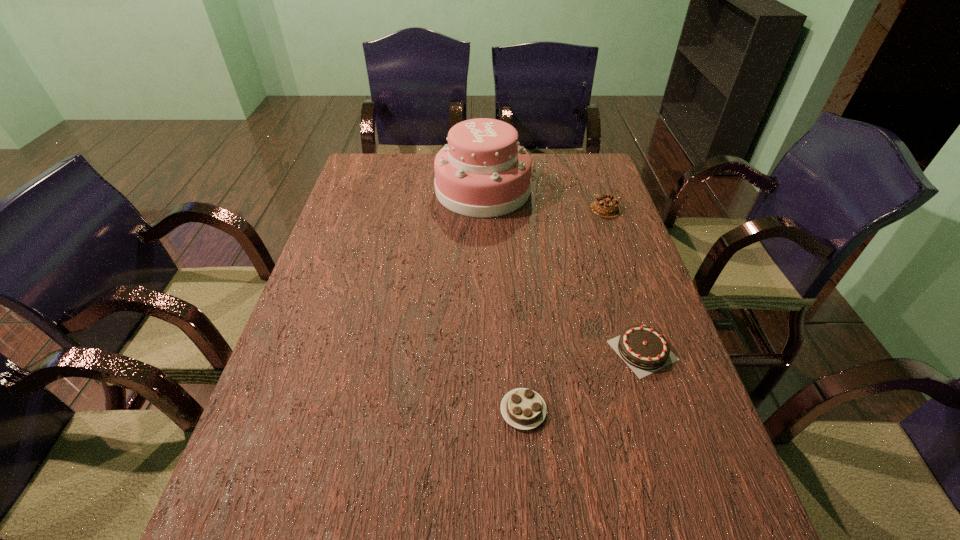
Locate an element on the screen. birthday cake is located at coordinates (483, 172).

The height and width of the screenshot is (540, 960). I want to click on the third shortest object, so click(x=606, y=206).

Locate an element on the screen. The image size is (960, 540). the farthest chocolate cake is located at coordinates (606, 206).

You are a GUI agent. You are given a task and a screenshot of the screen. Output one action in this format:
    pyautogui.click(x=<x>, y=<y>)
    Task: Click on the third tallest object
    
    Given the screenshot: What is the action you would take?
    pyautogui.click(x=645, y=350)

Locate an element on the screen. The image size is (960, 540). the second farthest chocolate cake is located at coordinates (645, 350).

Locate an element on the screen. The width and height of the screenshot is (960, 540). the shortest chocolate cake is located at coordinates (522, 408).

Image resolution: width=960 pixels, height=540 pixels. I want to click on the nearest object, so click(522, 408).

This screenshot has width=960, height=540. Identify the location of vacant space situated on the right of the birthday cake. (557, 190).

Find the location of a particular element. The width and height of the screenshot is (960, 540). vacant space situated on the front of the third shortest object is located at coordinates (626, 265).

Image resolution: width=960 pixels, height=540 pixels. What are the coordinates of `free space located on the back of the second nearest object` in the screenshot? It's located at (606, 239).